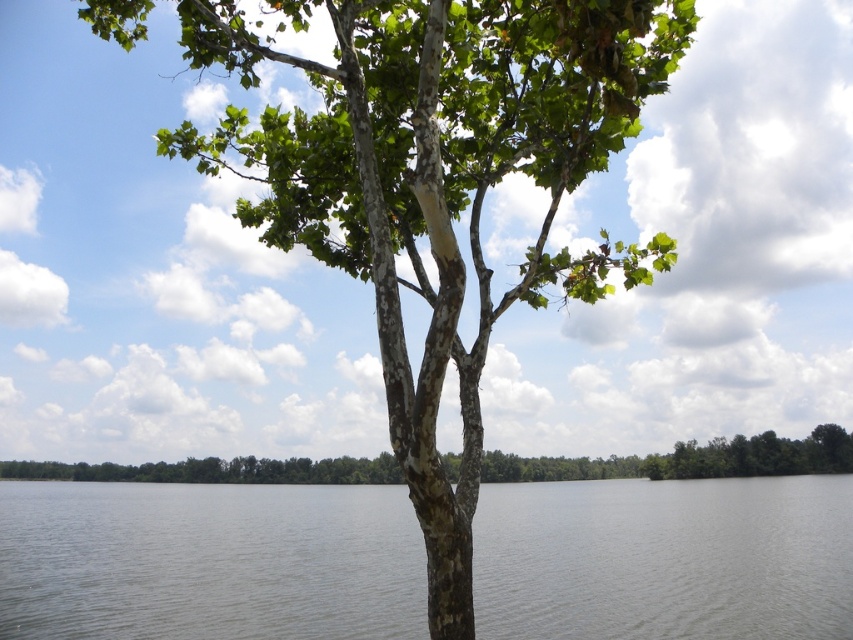
Question: Which point is farther from the camera taking this photo?

Choices:
 (A) (325, 115)
 (B) (372, 259)

Answer: (A)

Question: Does green bark tree at center appear on the right side of gray water at center?

Choices:
 (A) no
 (B) yes

Answer: (B)

Question: Can you confirm if smooth bark tree trunk at center is positioned below smooth bark tree at center?

Choices:
 (A) yes
 (B) no

Answer: (B)

Question: Which point is closer to the camera?

Choices:
 (A) (219, 8)
 (B) (833, 426)
 (C) (709, 621)
 (D) (424, 26)

Answer: (D)

Question: Can you confirm if green bark tree at center is wider than gray water at center?

Choices:
 (A) no
 (B) yes

Answer: (A)

Question: Among these objects, which one is nearest to the camera?

Choices:
 (A) green bark tree at center
 (B) smooth bark tree at center

Answer: (B)